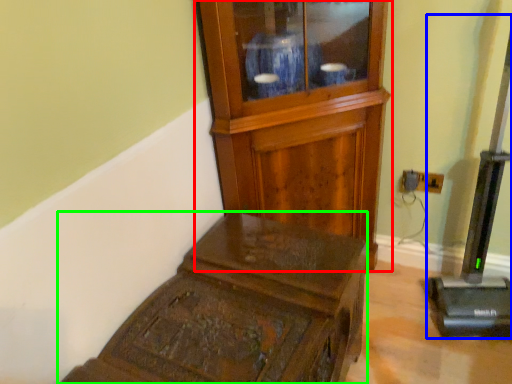
Question: Based on their relative distances, which object is nearer to side cabinet (highlighted by a red box)? Choose from equipment (highlighted by a blue box) and furniture (highlighted by a green box).

Choices:
 (A) equipment
 (B) furniture

Answer: (B)